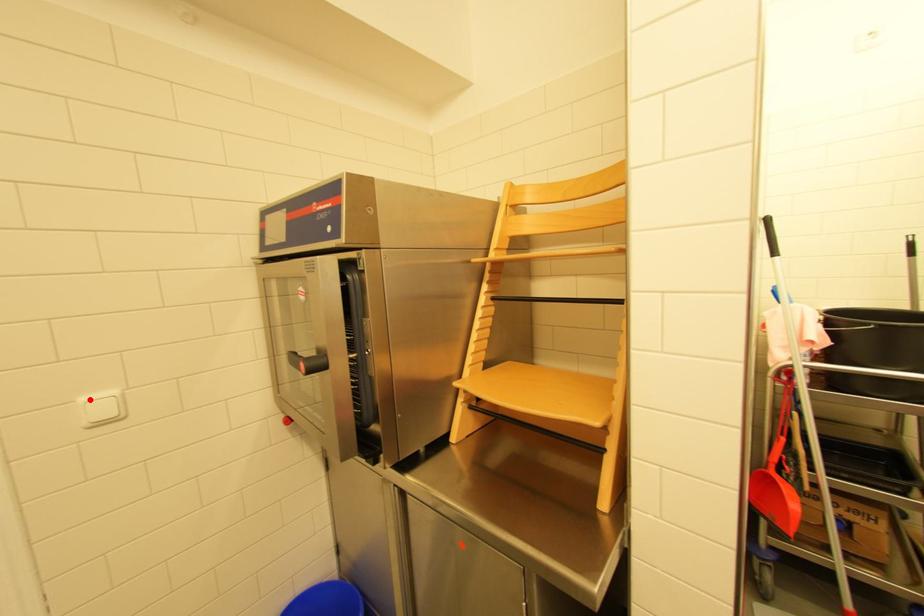
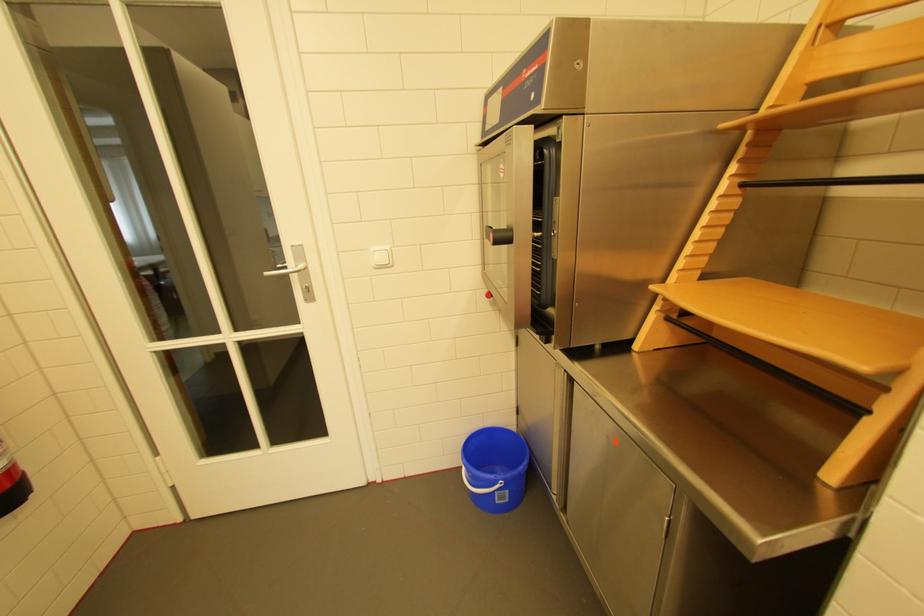
The point at the highlighted location is marked in the first image. Where is the corresponding point in the second image?

(380, 249)